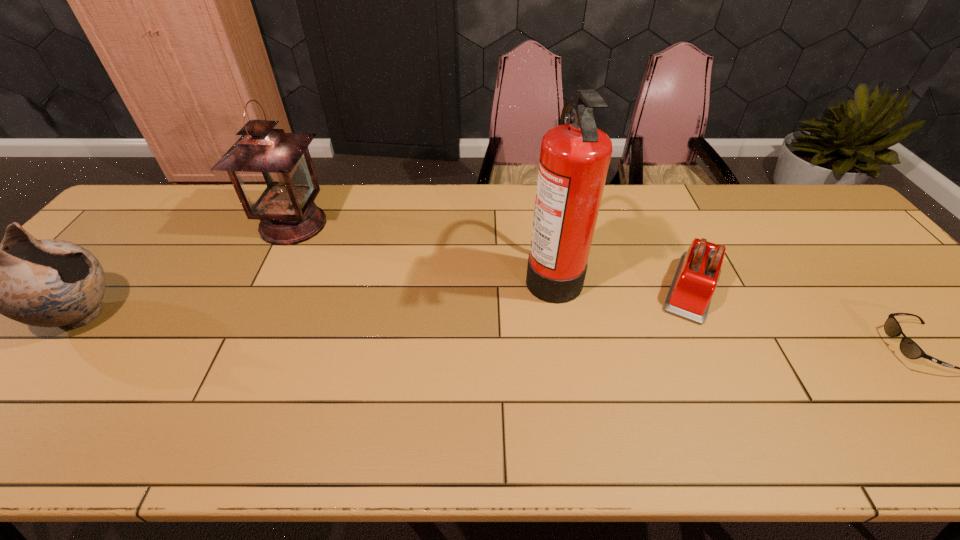
This screenshot has height=540, width=960. Find the location of `unoccupied position between the fire extinguisher and the third shortest object`. unoccupied position between the fire extinguisher and the third shortest object is located at coordinates (316, 294).

Image resolution: width=960 pixels, height=540 pixels. Find the location of `empty space that is in between the fourth shortest object and the pottery`. empty space that is in between the fourth shortest object and the pottery is located at coordinates (186, 270).

Locate an element on the screen. vacant area between the second object from left to right and the toaster is located at coordinates (492, 255).

Image resolution: width=960 pixels, height=540 pixels. I want to click on free space between the third shortest object and the fire extinguisher, so click(316, 294).

The image size is (960, 540). What are the coordinates of `empty space that is in between the third object from right to left and the oil lamp` in the screenshot? It's located at (422, 248).

Locate an element on the screen. free space between the fire extinguisher and the toaster is located at coordinates [622, 280].

What are the coordinates of `the fourth closest object to the third object from left to right` in the screenshot? It's located at (48, 283).

Locate which object is the third closest to the toaster. Please provide its 2D coordinates. Your answer should be formatted as a tuple, i.e. [(x, y)], where the tuple contains the x and y coordinates of a point satisfying the conditions above.

[(272, 172)]

At what (x,y) coordinates should I click in order to perform the action: click on vacant space that satisfies the following two spatial constraints: 1. on the front-facing side of the tallest object; 2. on the back side of the fourth object from left to right. Please return your answer as a coordinate pair (x, y). Looking at the image, I should click on (555, 287).